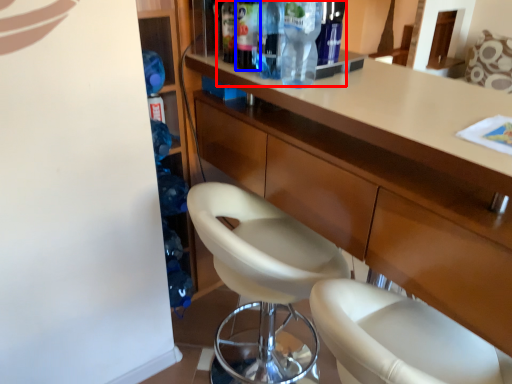
Question: Among these objects, which one is farthest to the camera, bottle (highlighted by a red box) or bottle (highlighted by a blue box)?

Choices:
 (A) bottle
 (B) bottle

Answer: (B)